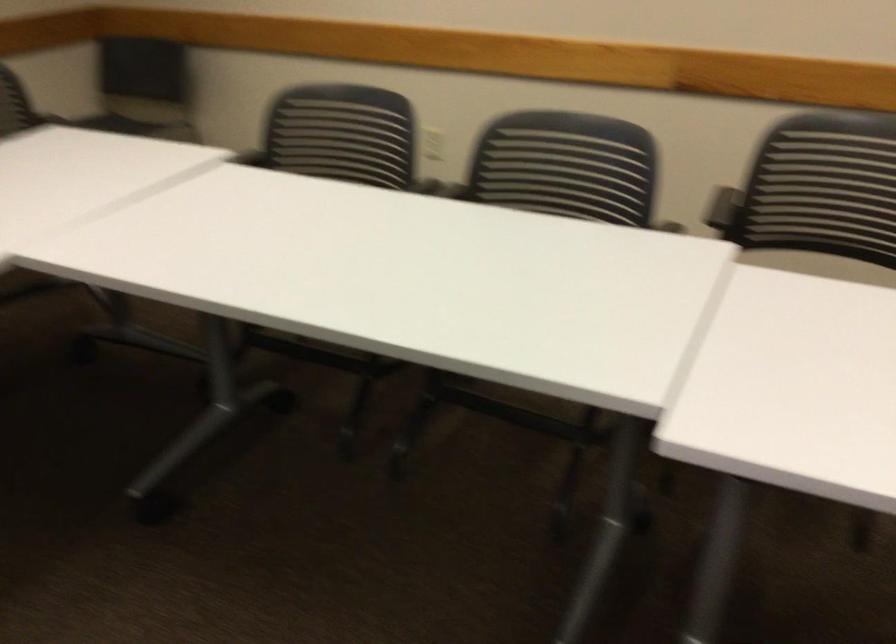
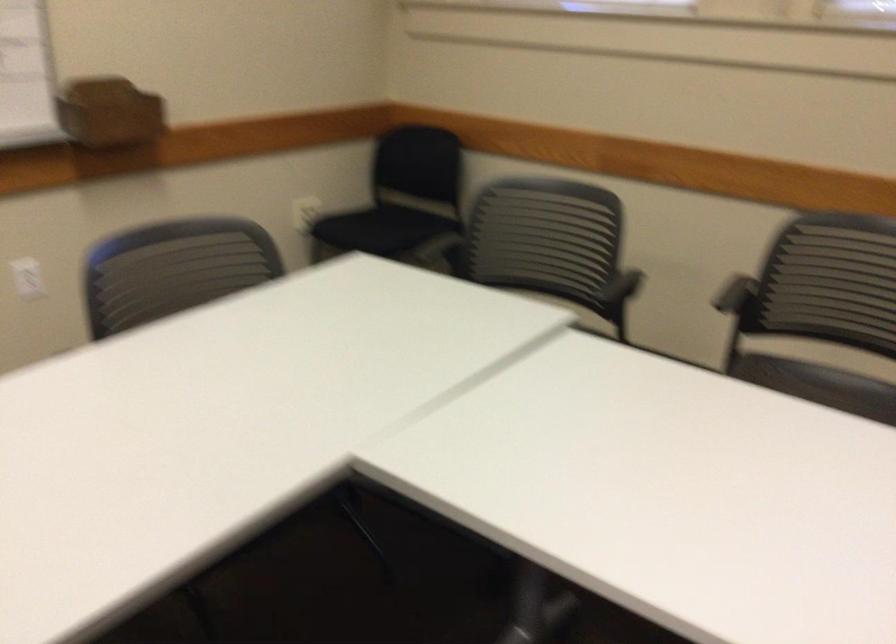
Based on the continuous images, in which direction is the camera rotating?

The camera rotated toward left-down.